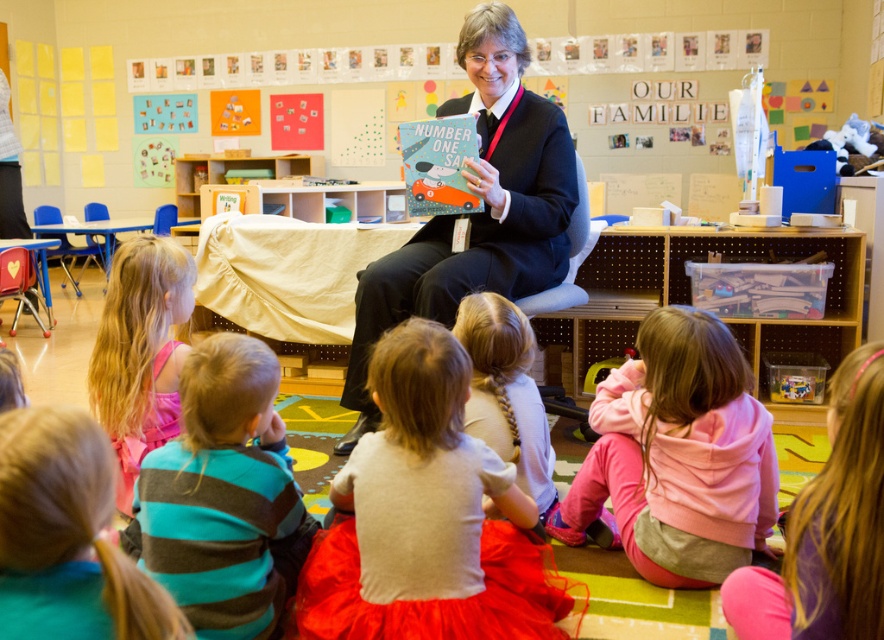
Can you confirm if striped cotton shirt at lower left is positioned to the left of pink fleece jacket at lower right?

Correct, you'll find striped cotton shirt at lower left to the left of pink fleece jacket at lower right.

The width and height of the screenshot is (884, 640). I want to click on striped cotton shirt at lower left, so click(x=223, y=497).

At what (x,y) coordinates should I click in order to perform the action: click on striped cotton shirt at lower left. Please return your answer as a coordinate pair (x, y). Looking at the image, I should click on (223, 497).

Is pink fleece hoodie at lower right smaller than pink fleece jacket at lower right?

Actually, pink fleece hoodie at lower right might be larger than pink fleece jacket at lower right.

Is point (775, 508) positioned behind point (869, 502)?

Yes, it is behind point (869, 502).

Locate an element on the screen. This screenshot has height=640, width=884. pink fleece hoodie at lower right is located at coordinates (677, 456).

Where is `white cotton tutu at center`? white cotton tutu at center is located at coordinates (427, 518).

How much distance is there between white cotton tutu at center and pink fleece jacket at lower right?

The distance of white cotton tutu at center from pink fleece jacket at lower right is 68.85 centimeters.

Is point (385, 611) positioned in front of point (875, 506)?

No, it is behind (875, 506).

You are a GUI agent. You are given a task and a screenshot of the screen. Output one action in this format:
    pyautogui.click(x=<x>, y=<y>)
    Task: Click on the white cotton tutu at center
    The image size is (884, 640).
    Given the screenshot: What is the action you would take?
    pyautogui.click(x=427, y=518)